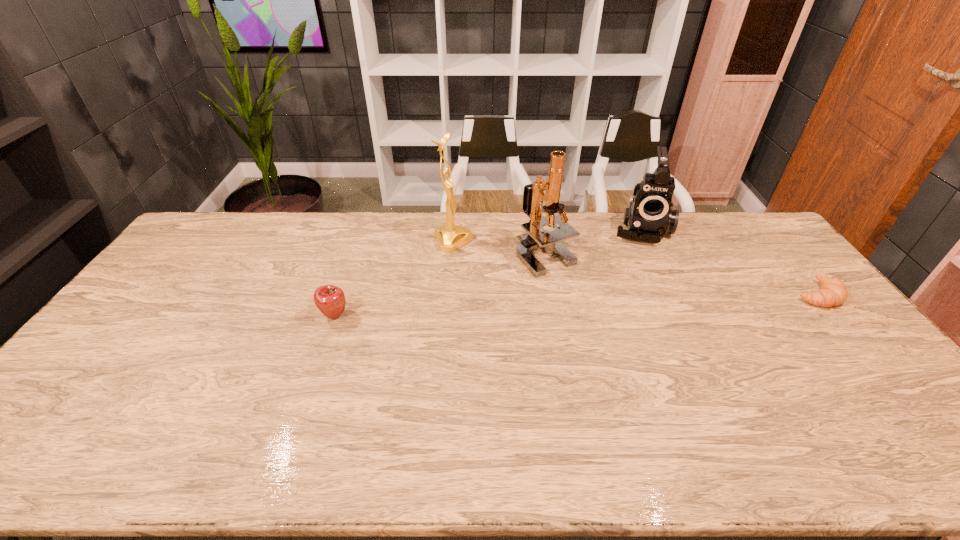
At what (x,y) coordinates should I click in order to perform the action: click on free area in between the leftmost object and the fourth object from left to right. Please return your answer as a coordinate pair (x, y). Looking at the image, I should click on (488, 272).

Locate an element on the screen. Image resolution: width=960 pixels, height=540 pixels. vacant region between the fourth object from left to right and the crescent roll is located at coordinates (729, 262).

Find the location of a particular element. Image resolution: width=960 pixels, height=540 pixels. unoccupied area between the camcorder and the crescent roll is located at coordinates (729, 262).

Image resolution: width=960 pixels, height=540 pixels. I want to click on free space between the apple and the crescent roll, so click(575, 305).

Where is `vacant region between the camcorder and the third object from left to right`? vacant region between the camcorder and the third object from left to right is located at coordinates (593, 241).

Image resolution: width=960 pixels, height=540 pixels. Identify the location of blank region between the second object from right to left and the leftmost object. (488, 272).

Choose which object is the second nearest neighbor to the rightmost object. Please provide its 2D coordinates. Your answer should be formatted as a tuple, i.e. [(x, y)], where the tuple contains the x and y coordinates of a point satisfying the conditions above.

[(536, 238)]

Locate which object ranks second in proximity to the fourth tallest object. Please provide its 2D coordinates. Your answer should be formatted as a tuple, i.e. [(x, y)], where the tuple contains the x and y coordinates of a point satisfying the conditions above.

[(536, 238)]

The image size is (960, 540). Identify the location of blank space that satisfies the following two spatial constraints: 1. on the back side of the fourth object from right to left; 2. on the left side of the leftmost object. (360, 241).

This screenshot has height=540, width=960. In order to click on free spot that satisfies the following two spatial constraints: 1. on the back side of the leftmost object; 2. on the left side of the award in this screenshot , I will do `click(360, 241)`.